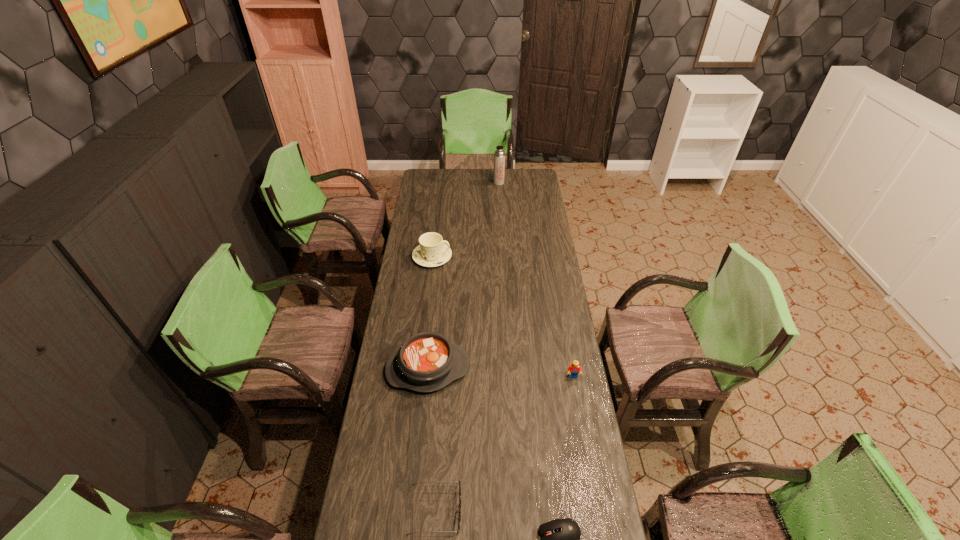
Locate an element on the screen. vacant space situated on the face of the rightmost object is located at coordinates (591, 476).

This screenshot has width=960, height=540. In order to click on free region located 0.280m through the lenses of the spectacles in this screenshot , I will do `click(554, 511)`.

The width and height of the screenshot is (960, 540). What are the coordinates of `object that is positioned at the far edge` in the screenshot? It's located at [499, 156].

Locate an element on the screen. The height and width of the screenshot is (540, 960). chinaware situated at the left edge is located at coordinates (432, 252).

Identify the location of casserole at the left edge. (426, 362).

This screenshot has height=540, width=960. What are the coordinates of `object located in the right edge section of the desktop` in the screenshot? It's located at (573, 370).

Image resolution: width=960 pixels, height=540 pixels. I want to click on free location at the far edge, so click(x=467, y=185).

Image resolution: width=960 pixels, height=540 pixels. Identify the location of vacant region at the left edge of the desktop. (402, 505).

Where is `vacant area at the right edge of the desktop`? Image resolution: width=960 pixels, height=540 pixels. vacant area at the right edge of the desktop is located at coordinates (525, 227).

This screenshot has height=540, width=960. I want to click on free space between the tallest object and the chinaware, so click(x=466, y=220).